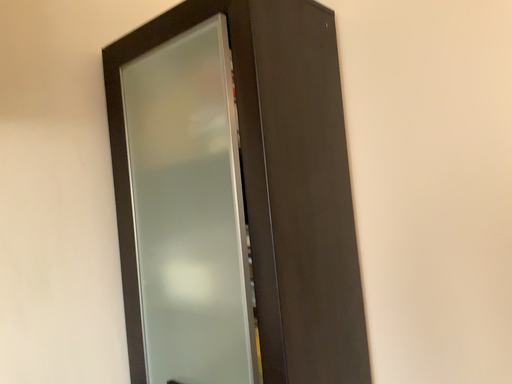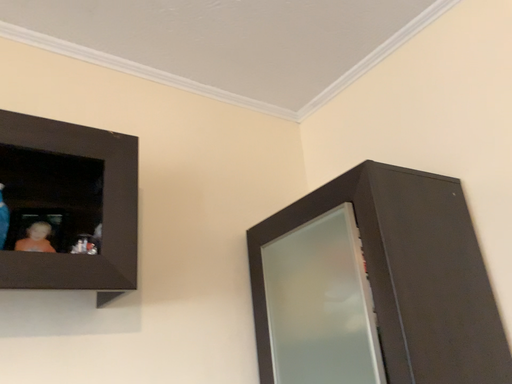
Question: How did the camera likely rotate when shooting the video?

Choices:
 (A) rotated left
 (B) rotated right

Answer: (A)